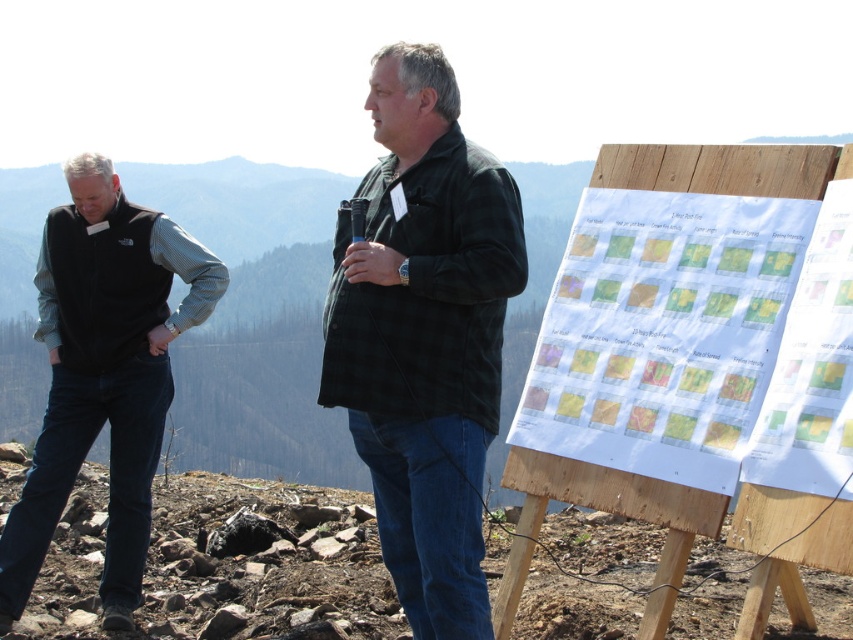
Does black corduroy jacket at center come in front of wooden at right?

No, it is not.

Which of these two, black corduroy jacket at center or wooden at right, stands shorter?

Standing shorter between the two is wooden at right.

The width and height of the screenshot is (853, 640). I want to click on black corduroy jacket at center, so click(x=424, y=333).

Between black fleece vest at left and wooden at right, which one has less height?

Standing shorter between the two is wooden at right.

Does point (15, 516) come closer to viewer compared to point (492, 627)?

No, (15, 516) is further to viewer.

What do you see at coordinates (103, 374) in the screenshot? I see `black fleece vest at left` at bounding box center [103, 374].

Locate an element on the screen. The height and width of the screenshot is (640, 853). black fleece vest at left is located at coordinates (103, 374).

Can you confirm if black corduroy jacket at center is wider than black fleece vest at left?

Incorrect, black corduroy jacket at center's width does not surpass black fleece vest at left's.

Between point (428, 472) and point (115, 289), which one is positioned behind?

Point (115, 289)

This screenshot has width=853, height=640. What are the coordinates of `black corduroy jacket at center` in the screenshot? It's located at (424, 333).

You are a GUI agent. You are given a task and a screenshot of the screen. Output one action in this format:
    pyautogui.click(x=<x>, y=<y>)
    Task: Click on the black corduroy jacket at center
    This screenshot has height=640, width=853.
    Given the screenshot: What is the action you would take?
    pyautogui.click(x=424, y=333)